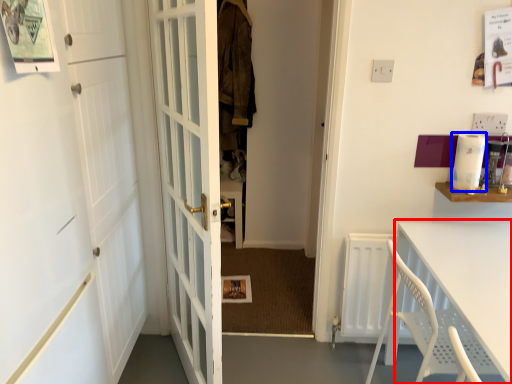
Question: Among these objects, which one is farthest to the camera, table (highlighted by a red box) or appliance (highlighted by a blue box)?

Choices:
 (A) table
 (B) appliance

Answer: (B)